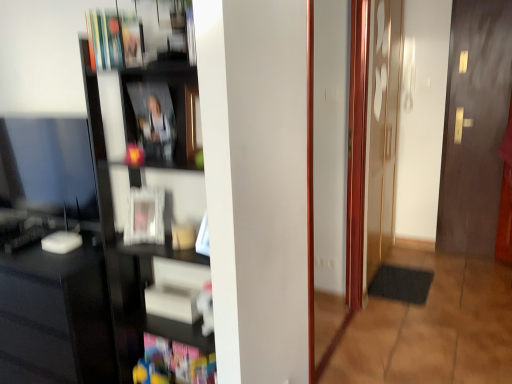
Question: Is matte white photo frame at center, positioned as the 5th book in top-to-bottom order, turned away from black rubber mat at lower right?

Choices:
 (A) no
 (B) yes

Answer: (A)

Question: From a real-world perspective, does matte white photo frame at center, which ranks as the third book in bottom-to-top order, sit lower than black rubber mat at lower right?

Choices:
 (A) no
 (B) yes

Answer: (A)

Question: Is matte white photo frame at center, positioned as the 5th book in top-to-bottom order, shorter than black rubber mat at lower right?

Choices:
 (A) yes
 (B) no

Answer: (B)

Question: Is the position of matte white photo frame at center, positioned as the 5th book in top-to-bottom order, less distant than that of black rubber mat at lower right?

Choices:
 (A) yes
 (B) no

Answer: (A)

Question: From the image's perspective, is matte white photo frame at center, which ranks as the third book in bottom-to-top order, located beneath black rubber mat at lower right?

Choices:
 (A) no
 (B) yes

Answer: (A)

Question: Is matte white photo frame at center, which ranks as the third book in bottom-to-top order, further to the viewer compared to black rubber mat at lower right?

Choices:
 (A) yes
 (B) no

Answer: (B)

Question: Does hardcover book at upper left, the seventh book positioned from the bottom, have a greater width compared to black rubber mat at lower right?

Choices:
 (A) yes
 (B) no

Answer: (B)

Question: Is hardcover book at upper left, the seventh book positioned from the bottom, positioned far away from black rubber mat at lower right?

Choices:
 (A) no
 (B) yes

Answer: (B)

Question: Can you confirm if hardcover book at upper left, placed as the 1th book when sorted from top to bottom, is taller than black rubber mat at lower right?

Choices:
 (A) no
 (B) yes

Answer: (B)

Question: Is the surface of hardcover book at upper left, placed as the 1th book when sorted from top to bottom, in direct contact with black rubber mat at lower right?

Choices:
 (A) yes
 (B) no

Answer: (B)

Question: From a real-world perspective, is hardcover book at upper left, the seventh book positioned from the bottom, physically above black rubber mat at lower right?

Choices:
 (A) no
 (B) yes

Answer: (B)

Question: Is hardcover book at upper left, the seventh book positioned from the bottom, smaller than black rubber mat at lower right?

Choices:
 (A) no
 (B) yes

Answer: (A)

Question: Considering the relative positions of hardcover book at upper left, the seventh book positioned from the bottom, and dark wood door at right in the image provided, is hardcover book at upper left, the seventh book positioned from the bottom, in front of dark wood door at right?

Choices:
 (A) yes
 (B) no

Answer: (A)